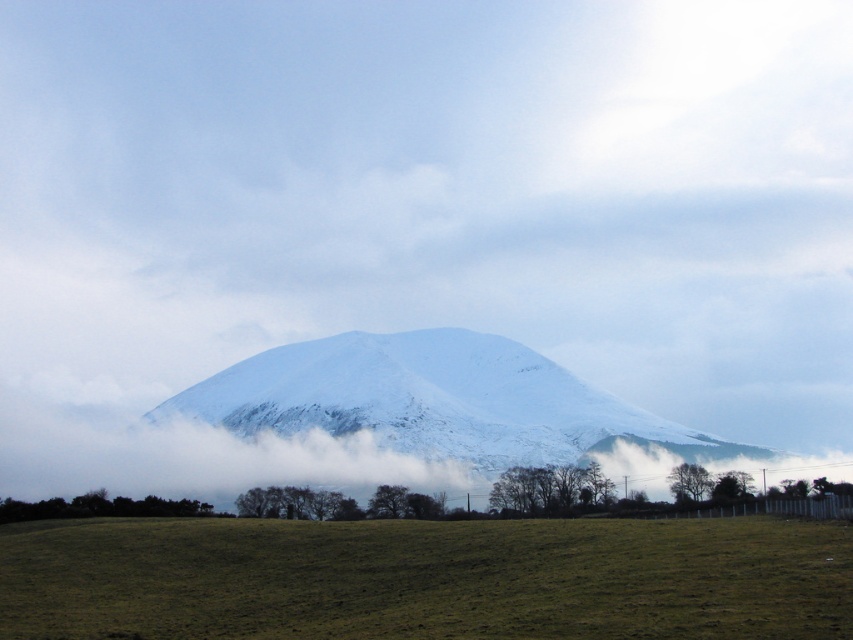
Can you confirm if green grassy field at lower center is positioned to the left of white snow-covered mountain at center?

Incorrect, green grassy field at lower center is not on the left side of white snow-covered mountain at center.

Between green grassy field at lower center and white snow-covered mountain at center, which one has less height?

With less height is green grassy field at lower center.

Where is `green grassy field at lower center`? The width and height of the screenshot is (853, 640). green grassy field at lower center is located at coordinates (426, 577).